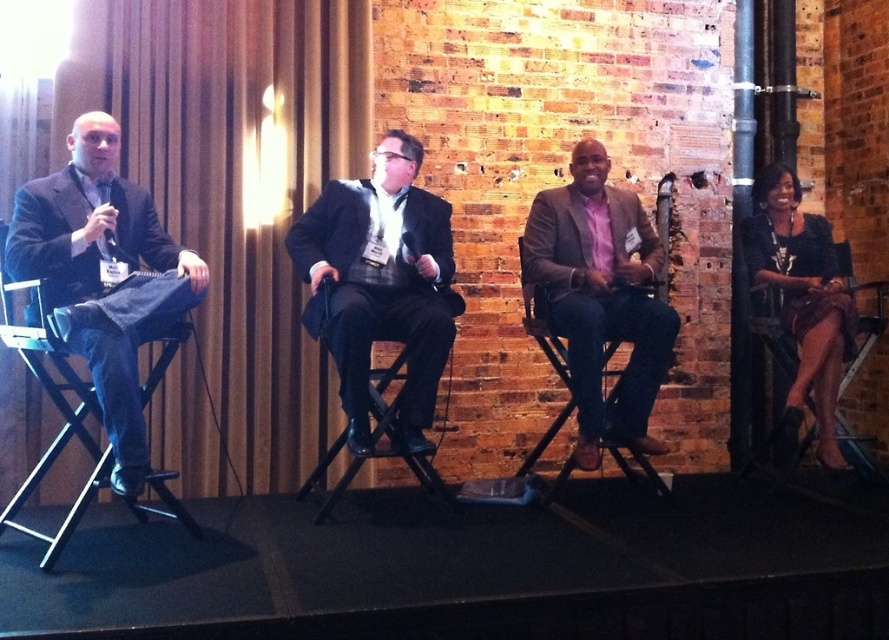
Can you confirm if pink matte shirt at center is positioned above black leather chair at right?

Correct, pink matte shirt at center is located above black leather chair at right.

Between point (583, 193) and point (767, 323), which one is positioned in front?

Point (583, 193) is more forward.

Where is `pink matte shirt at center`? The image size is (889, 640). pink matte shirt at center is located at coordinates (601, 298).

The image size is (889, 640). What are the coordinates of `pink matte shirt at center` in the screenshot? It's located at (601, 298).

How distant is matte black suit at left from black leather chair at center?

31.95 inches

Can you confirm if matte black suit at left is shorter than black leather chair at center?

No.

Does point (181, 314) come closer to viewer compared to point (429, 477)?

That is True.

I want to click on matte black suit at left, so click(x=103, y=276).

Who is higher up, matte black suit at left or black leather chair at right?

matte black suit at left

Which is behind, point (78, 216) or point (837, 417)?

The point (837, 417) is more distant.

Is point (90, 218) positioned behind point (757, 333)?

No, (90, 218) is in front of (757, 333).

The image size is (889, 640). I want to click on matte black suit at left, so click(103, 276).